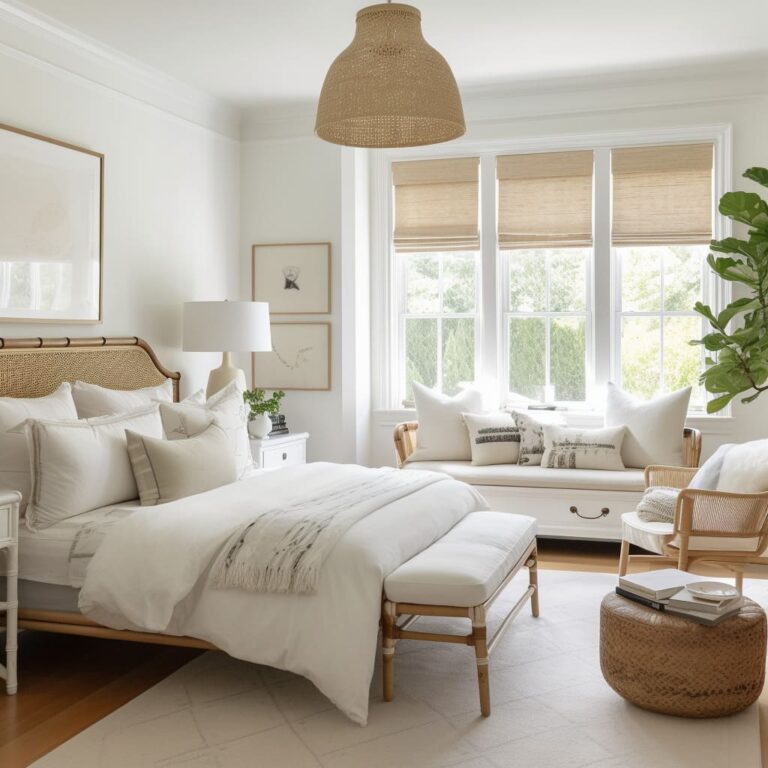
At what (x,y) coordinates should I click in order to perform the action: click on wooden flooring. Please return your answer as a coordinate pair (x, y). Looking at the image, I should click on (68, 713), (567, 558).